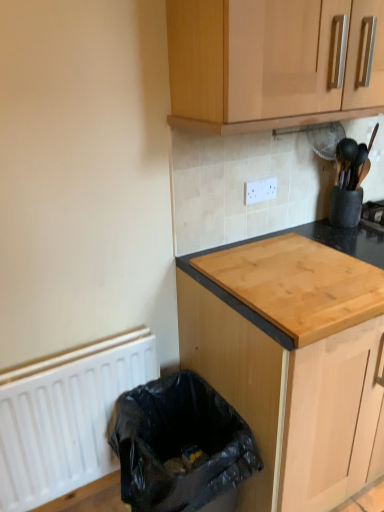
At what (x,y) coordinates should I click in order to perform the action: click on natural wood cutting board at center, which is the first cabinetry from bottom to top. Please return your answer as a coordinate pair (x, y). This screenshot has height=512, width=384. Looking at the image, I should click on (289, 360).

The image size is (384, 512). What are the coordinates of `wooden cabinet at upper center, which is the 1th cabinetry in top-to-bottom order` in the screenshot? It's located at (265, 63).

I want to click on white matte radiator at lower left, so click(66, 417).

Measure the distance between point [342,230] and camera.

Point [342,230] is 1.70 meters from camera.

What is the approximate height of white plastic electric outlet at upper center?

white plastic electric outlet at upper center is 3.49 inches in height.

This screenshot has width=384, height=512. Find the location of `natural wood cutting board at center, which appears as the 2th cabinetry when viewed from the top`. natural wood cutting board at center, which appears as the 2th cabinetry when viewed from the top is located at coordinates point(289,360).

Which of these two, white matte radiator at lower left or natural wood cutting board at center, which is the first cabinetry from bottom to top, stands shorter?

white matte radiator at lower left.

Looking at this image, would you say white matte radiator at lower left is to the left or to the right of natural wood cutting board at center, which is the first cabinetry from bottom to top, in the picture?

Clearly, white matte radiator at lower left is on the left of natural wood cutting board at center, which is the first cabinetry from bottom to top, in the image.

Considering the positions of point (46, 381) and point (356, 365), is point (46, 381) closer or farther from the camera than point (356, 365)?

Point (46, 381).

Is white matte radiator at lower left beside natural wood cutting board at center, which is the first cabinetry from bottom to top?

No, white matte radiator at lower left is not with natural wood cutting board at center, which is the first cabinetry from bottom to top.

Locate an element on the screen. The image size is (384, 512). radiator on the left of black plastic bag at lower left is located at coordinates (66, 417).

Is white matte radiator at lower left facing away from black plastic bag at lower left?

white matte radiator at lower left is not turned away from black plastic bag at lower left.

From the picture: From the image's perspective, is white matte radiator at lower left on black plastic bag at lower left?

Yes.

From a real-world perspective, which object rests below the other?

In real-world perspective, black plastic bag at lower left is lower.

Considering the positions of points (267, 187) and (188, 416), is point (267, 187) farther from camera compared to point (188, 416)?

Yes, it is.

Is white plastic electric outlet at upper center next to black plastic bag at lower left and touching it?

No, white plastic electric outlet at upper center is not in contact with black plastic bag at lower left.

Considering the relative positions of white plastic electric outlet at upper center and black plastic bag at lower left in the image provided, is white plastic electric outlet at upper center to the right of black plastic bag at lower left from the viewer's perspective?

Indeed, white plastic electric outlet at upper center is positioned on the right side of black plastic bag at lower left.

Is black plastic bag at lower left facing away from white plastic electric outlet at upper center?

No, black plastic bag at lower left's orientation is not away from white plastic electric outlet at upper center.

Does black plastic bag at lower left have a lesser width compared to white plastic electric outlet at upper center?

In fact, black plastic bag at lower left might be wider than white plastic electric outlet at upper center.

How different are the orientations of black plastic bag at lower left and white plastic electric outlet at upper center in degrees?

The facing directions of black plastic bag at lower left and white plastic electric outlet at upper center are 1.53 degrees apart.

Is black plastic bag at lower left located outside white plastic electric outlet at upper center?

Absolutely, black plastic bag at lower left is external to white plastic electric outlet at upper center.

Which object is thinner, wooden cabinet at upper center, which is the 1th cabinetry in top-to-bottom order, or white plastic electric outlet at upper center?

white plastic electric outlet at upper center is thinner.

From the image's perspective, between wooden cabinet at upper center, arranged as the 2th cabinetry when ordered from the bottom, and white plastic electric outlet at upper center, who is located below?

From the image's view, white plastic electric outlet at upper center is below.

Considering the relative sizes of wooden cabinet at upper center, arranged as the 2th cabinetry when ordered from the bottom, and white plastic electric outlet at upper center in the image provided, is wooden cabinet at upper center, arranged as the 2th cabinetry when ordered from the bottom, smaller than white plastic electric outlet at upper center?

No.

Which is closer to the camera, (272,73) or (275,179)?

Point (272,73)

Who is shorter, natural wood cutting board at center, which appears as the 2th cabinetry when viewed from the top, or wooden cabinet at upper center, which is the 1th cabinetry in top-to-bottom order?

Standing shorter between the two is wooden cabinet at upper center, which is the 1th cabinetry in top-to-bottom order.

Which object is thinner, natural wood cutting board at center, which is the first cabinetry from bottom to top, or wooden cabinet at upper center, arranged as the 2th cabinetry when ordered from the bottom?

wooden cabinet at upper center, arranged as the 2th cabinetry when ordered from the bottom.

Where is `cabinetry that appears behind the wooden cabinet at upper center, which is the 1th cabinetry in top-to-bottom order`? cabinetry that appears behind the wooden cabinet at upper center, which is the 1th cabinetry in top-to-bottom order is located at coordinates click(x=289, y=360).

Measure the distance between natural wood cutting board at center, which appears as the 2th cabinetry when viewed from the top, and wooden cabinet at upper center, arranged as the 2th cabinetry when ordered from the bottom.

natural wood cutting board at center, which appears as the 2th cabinetry when viewed from the top, and wooden cabinet at upper center, arranged as the 2th cabinetry when ordered from the bottom, are 26.04 inches apart from each other.

Would you say natural wood countertop at center is part of white matte radiator at lower left's contents?

No, natural wood countertop at center is not inside white matte radiator at lower left.

From the image's perspective, which object appears higher, white matte radiator at lower left or natural wood countertop at center?

From the image's view, natural wood countertop at center is above.

Between white matte radiator at lower left and natural wood countertop at center, which one appears on the right side from the viewer's perspective?

natural wood countertop at center is more to the right.

Between point (47, 390) and point (358, 249), which one is positioned behind?

The point (358, 249) is behind.

This screenshot has height=512, width=384. What are the coordinates of `radiator lying behind the natural wood cutting board at center, which is the first cabinetry from bottom to top` in the screenshot? It's located at (66, 417).

Identify the location of radiator located above the black plastic bag at lower left (from the image's perspective). (66, 417).

Based on their spatial positions, is white plastic electric outlet at upper center or natural wood countertop at center further from wooden cabinet at upper center, arranged as the 2th cabinetry when ordered from the bottom?

natural wood countertop at center.

Considering their positions, is wooden cabinet at upper center, which is the 1th cabinetry in top-to-bottom order, positioned further to black plastic bag at lower left than natural wood cutting board at center, which appears as the 2th cabinetry when viewed from the top?

wooden cabinet at upper center, which is the 1th cabinetry in top-to-bottom order, is positioned further to the anchor black plastic bag at lower left.

Based on their spatial positions, is white matte radiator at lower left or wooden cabinet at upper center, arranged as the 2th cabinetry when ordered from the bottom, further from natural wood countertop at center?

The object further to natural wood countertop at center is white matte radiator at lower left.

Which object lies nearer to the anchor point white matte radiator at lower left, black plastic bag at lower left or natural wood cutting board at center, which is the first cabinetry from bottom to top?

Based on the image, black plastic bag at lower left appears to be nearer to white matte radiator at lower left.

Looking at this image, based on their spatial positions, is black plastic bag at lower left or wooden cabinet at upper center, arranged as the 2th cabinetry when ordered from the bottom, further from white matte radiator at lower left?

Among the two, wooden cabinet at upper center, arranged as the 2th cabinetry when ordered from the bottom, is located further to white matte radiator at lower left.

Which object lies further to the anchor point white matte radiator at lower left, natural wood countertop at center or wooden cabinet at upper center, arranged as the 2th cabinetry when ordered from the bottom?

Among the two, wooden cabinet at upper center, arranged as the 2th cabinetry when ordered from the bottom, is located further to white matte radiator at lower left.

From the image, which object appears to be nearer to white matte radiator at lower left, white plastic electric outlet at upper center or black plastic bag at lower left?

black plastic bag at lower left.

Based on the photo, looking at the image, which one is located further to white plastic electric outlet at upper center, black plastic bag at lower left or white matte radiator at lower left?

white matte radiator at lower left.

Where is `radiator between natural wood countertop at center and black plastic bag at lower left in the up-down direction`? radiator between natural wood countertop at center and black plastic bag at lower left in the up-down direction is located at coordinates (66, 417).

Where is `cabinetry between wooden cabinet at upper center, which is the 1th cabinetry in top-to-bottom order, and white matte radiator at lower left, in the vertical direction`? The width and height of the screenshot is (384, 512). cabinetry between wooden cabinet at upper center, which is the 1th cabinetry in top-to-bottom order, and white matte radiator at lower left, in the vertical direction is located at coordinates (289, 360).

At what (x,y) coordinates should I click in order to perform the action: click on countertop between white plastic electric outlet at upper center and white matte radiator at lower left vertically. Please return your answer as a coordinate pair (x, y). The height and width of the screenshot is (512, 384). Looking at the image, I should click on (283, 234).

Find the location of a particular element. The width and height of the screenshot is (384, 512). countertop between wooden cabinet at upper center, arranged as the 2th cabinetry when ordered from the bottom, and black plastic bag at lower left, in the vertical direction is located at coordinates (283, 234).